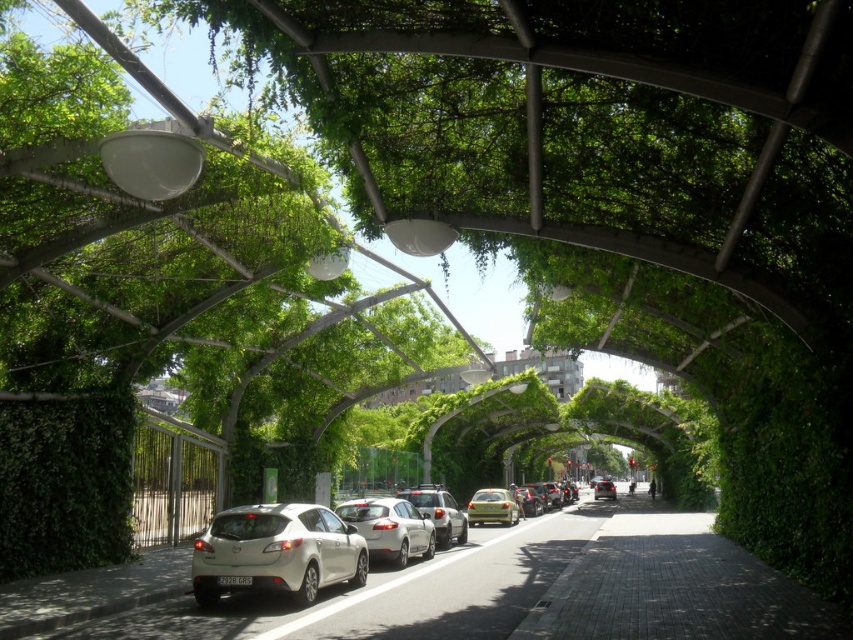
Question: Can you confirm if green leafy hedge at left is bigger than white matte car at center?

Choices:
 (A) yes
 (B) no

Answer: (B)

Question: Is green leafy hedge at left wider than green matte car at center?

Choices:
 (A) yes
 (B) no

Answer: (B)

Question: Which object is closer to the camera taking this photo?

Choices:
 (A) green matte car at center
 (B) satin white sedan at center
 (C) white matte hatchback at center
 (D) satin white hatchback at center

Answer: (C)

Question: Among these objects, which one is nearest to the camera?

Choices:
 (A) matte silver sedan at center
 (B) satin white hatchback at center
 (C) satin white sedan at center
 (D) white matte car at center

Answer: (B)

Question: Which point appears farthest from the camera in this image?

Choices:
 (A) (354, 557)
 (B) (76, 557)
 (C) (473, 518)
 (D) (424, 557)

Answer: (C)

Question: Is green leafy hedge at left smaller than white matte car at center?

Choices:
 (A) yes
 (B) no

Answer: (A)